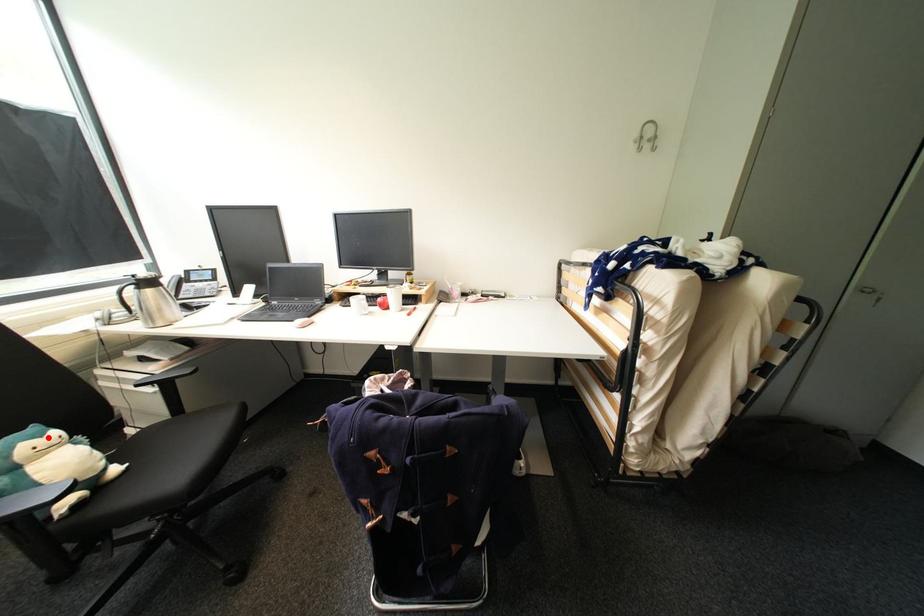
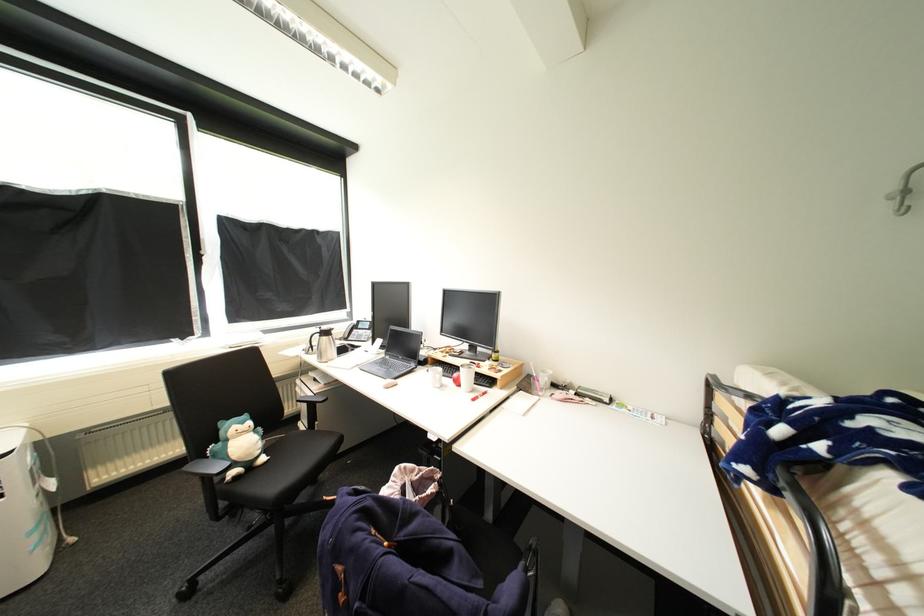
Question: I am providing you with two images of the same scene from different viewpoints. In image1, a red point is highlighted. Considering the same 3D point in image2, which of the following is correct?

Choices:
 (A) It is closer
 (B) It is farther

Answer: (A)